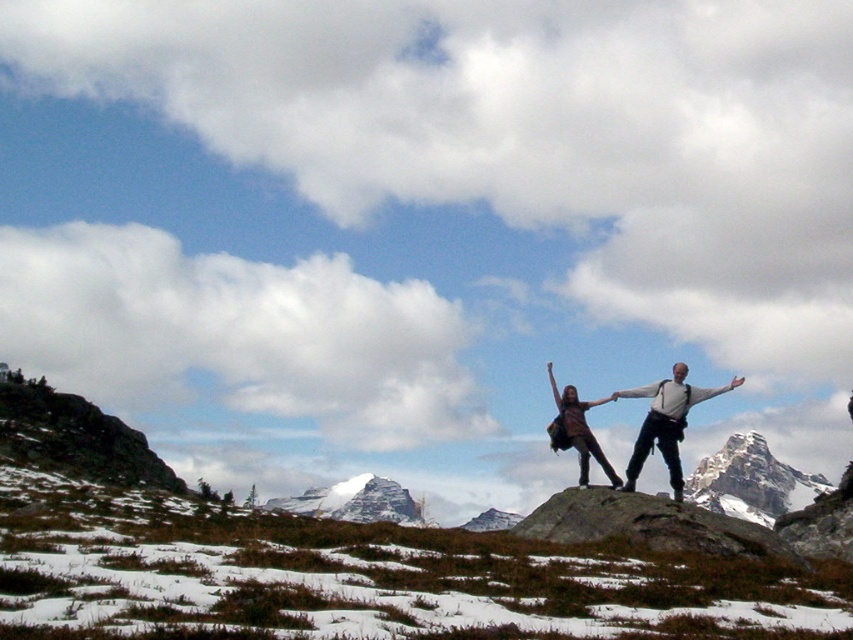
Is snowy granite peak at upper right above striped fabric dress at center?

Incorrect, snowy granite peak at upper right is not positioned above striped fabric dress at center.

Measure the distance between snowy granite peak at upper right and striped fabric dress at center.

snowy granite peak at upper right is 368.75 meters away from striped fabric dress at center.

Who is more distant from viewer, [749,433] or [589,408]?

The point [749,433] is behind.

Where is `snowy granite peak at upper right`? snowy granite peak at upper right is located at coordinates (751, 481).

Does snowy granite peak at upper right have a larger size compared to matte brown backpack at center?

Indeed, snowy granite peak at upper right has a larger size compared to matte brown backpack at center.

Which of these two, snowy granite peak at upper right or matte brown backpack at center, stands taller?

Standing taller between the two is snowy granite peak at upper right.

Who is more forward, (699, 461) or (672, 436)?

Point (672, 436)

I want to click on snowy granite peak at upper right, so click(751, 481).

Looking at this image, is matte brown backpack at center positioned in front of striped fabric dress at center?

Yes.

Where is `matte brown backpack at center`? This screenshot has width=853, height=640. matte brown backpack at center is located at coordinates (665, 422).

Where is `matte brown backpack at center`? The height and width of the screenshot is (640, 853). matte brown backpack at center is located at coordinates (665, 422).